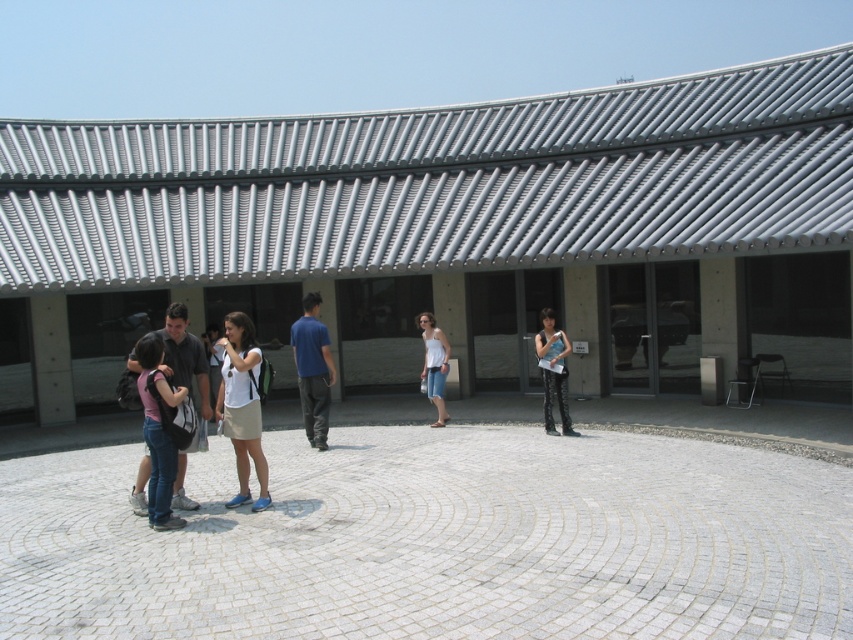
Who is positioned more to the right, pink fabric shirt at center or blue fabric shirt at center?

blue fabric shirt at center

Is point (167, 486) closer to viewer compared to point (316, 433)?

Yes, point (167, 486) is in front of point (316, 433).

Identify the location of pink fabric shirt at center. The height and width of the screenshot is (640, 853). (157, 429).

Is white stone courtyard at center taller than blue fabric shirt at center?

Incorrect, white stone courtyard at center's height is not larger of blue fabric shirt at center's.

Can you confirm if white stone courtyard at center is positioned to the left of blue fabric shirt at center?

Correct, you'll find white stone courtyard at center to the left of blue fabric shirt at center.

Describe the element at coordinates (437, 540) in the screenshot. I see `white stone courtyard at center` at that location.

I want to click on white stone courtyard at center, so (437, 540).

Does blue fabric shirt at center appear on the right side of denim pants at center?

No, blue fabric shirt at center is not to the right of denim pants at center.

Is point (316, 333) positioned in front of point (546, 346)?

Yes, point (316, 333) is closer to viewer.

Find the location of a particular element. blue fabric shirt at center is located at coordinates pos(312,369).